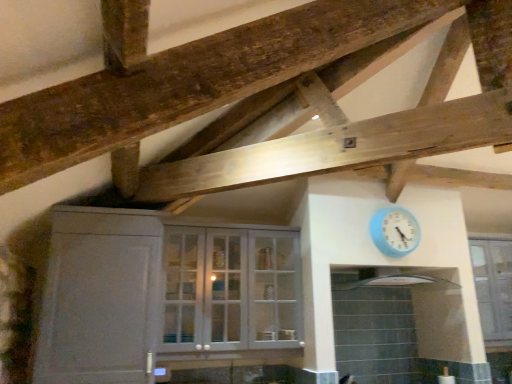
Question: From a real-world perspective, is white matte cabinet at left located beneath clear glass cabinet at upper center?

Choices:
 (A) yes
 (B) no

Answer: (A)

Question: Is white matte cabinet at left positioned with its back to clear glass cabinet at upper center?

Choices:
 (A) yes
 (B) no

Answer: (B)

Question: Can you confirm if white matte cabinet at left is shorter than clear glass cabinet at upper center?

Choices:
 (A) yes
 (B) no

Answer: (B)

Question: Is white matte cabinet at left further to camera compared to clear glass cabinet at upper center?

Choices:
 (A) yes
 (B) no

Answer: (B)

Question: From a real-world perspective, is white matte cabinet at left positioned over clear glass cabinet at upper center based on gravity?

Choices:
 (A) yes
 (B) no

Answer: (B)

Question: Can you confirm if white matte cabinet at left is bigger than clear glass cabinet at upper center?

Choices:
 (A) no
 (B) yes

Answer: (B)

Question: Does white glossy exhaust hood at upper center have a smaller size compared to light blue plastic wall clock at upper right?

Choices:
 (A) no
 (B) yes

Answer: (A)

Question: Does white glossy exhaust hood at upper center appear on the right side of light blue plastic wall clock at upper right?

Choices:
 (A) yes
 (B) no

Answer: (B)

Question: Is white glossy exhaust hood at upper center far away from light blue plastic wall clock at upper right?

Choices:
 (A) no
 (B) yes

Answer: (A)

Question: Can you confirm if white glossy exhaust hood at upper center is positioned to the left of light blue plastic wall clock at upper right?

Choices:
 (A) yes
 (B) no

Answer: (A)

Question: Can you confirm if white glossy exhaust hood at upper center is thinner than light blue plastic wall clock at upper right?

Choices:
 (A) yes
 (B) no

Answer: (B)

Question: Does white glossy exhaust hood at upper center have a larger size compared to light blue plastic wall clock at upper right?

Choices:
 (A) yes
 (B) no

Answer: (A)

Question: Can you confirm if light blue plastic wall clock at upper right is positioned to the right of white glossy exhaust hood at upper center?

Choices:
 (A) yes
 (B) no

Answer: (A)